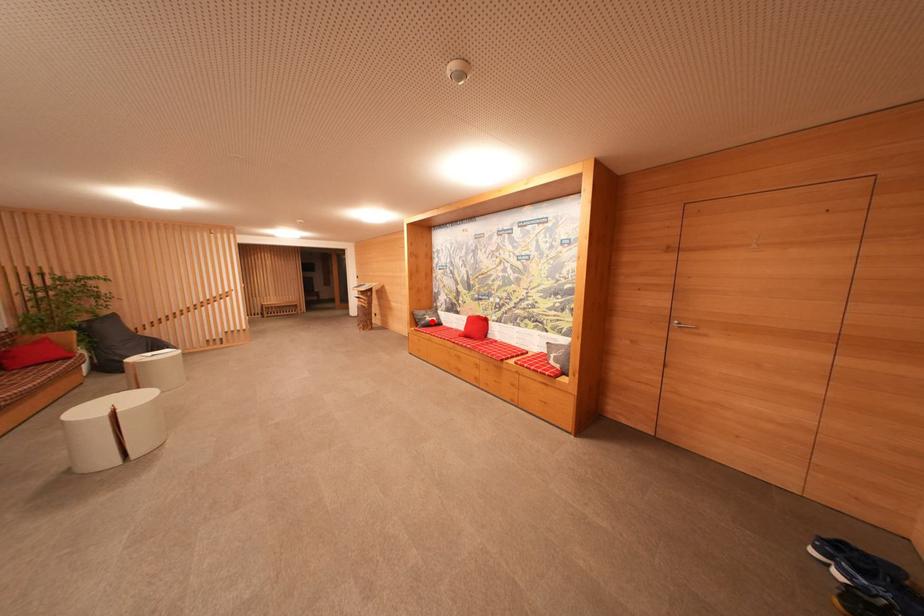
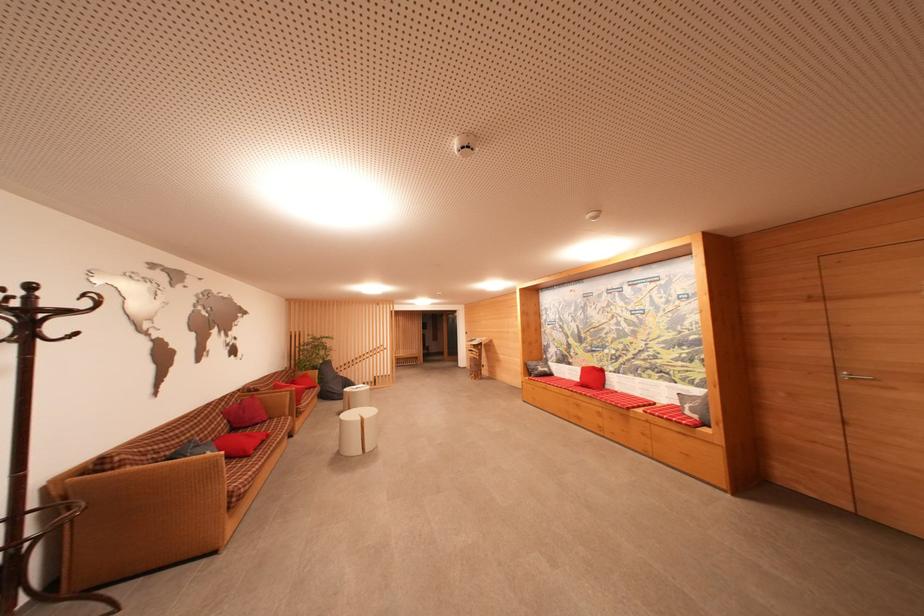
Where in the second image is the point corresponding to the highlighted location from the first image?

(544, 371)